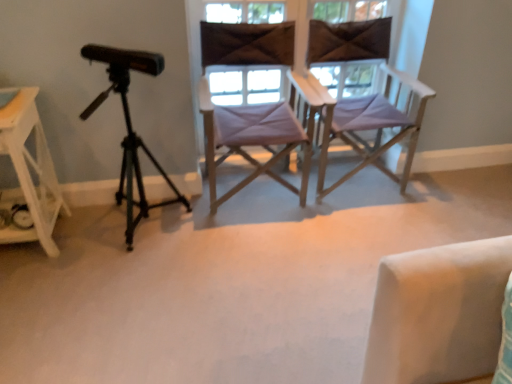
The height and width of the screenshot is (384, 512). I want to click on vacant area that lies between white wood side table at left and black matte tripod at left, so click(91, 236).